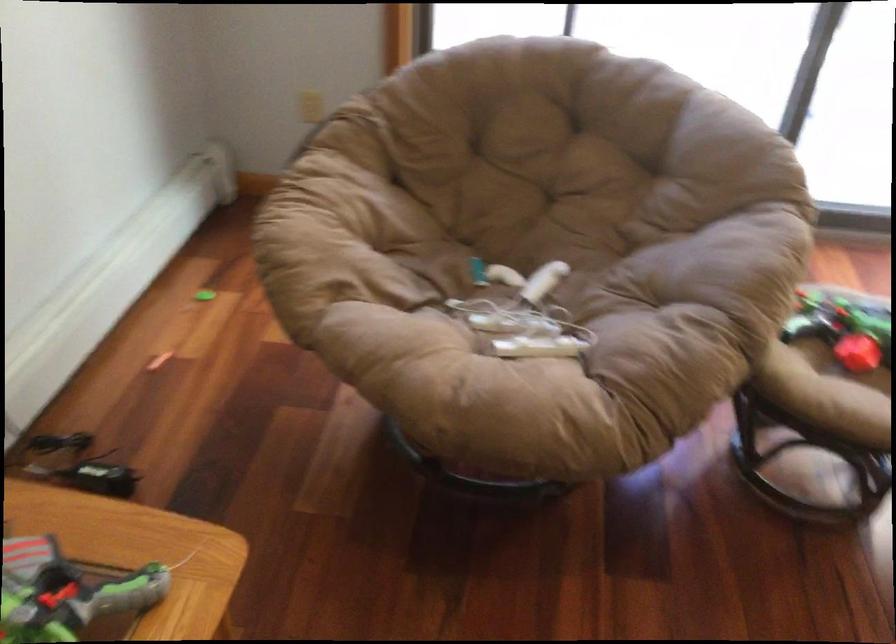
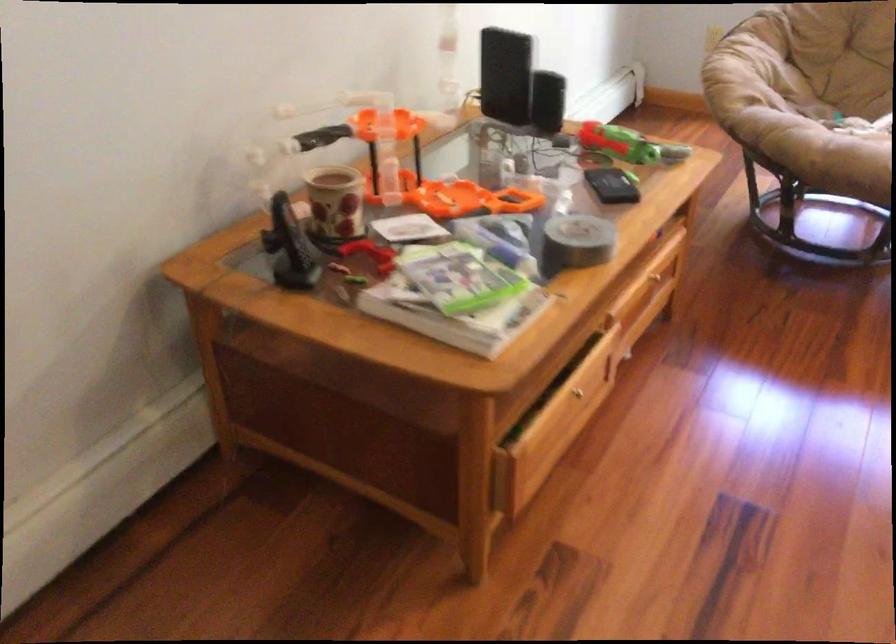
In the second image, find the point that corresponds to (x=502, y=265) in the first image.

(842, 118)